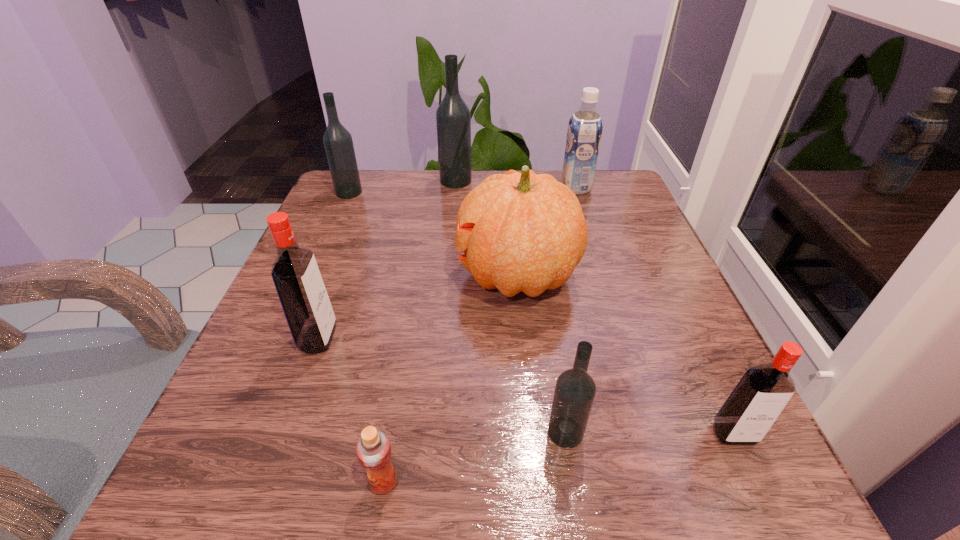
This screenshot has height=540, width=960. In order to click on vodka that is the nearest to the rightmost object in this screenshot , I will do `click(575, 390)`.

This screenshot has height=540, width=960. I want to click on vodka identified as the third closest to the biggest black vodka, so click(x=575, y=390).

Identify which black vodka is the third closest to the bigger red vodka. Please provide its 2D coordinates. Your answer should be formatted as a tuple, i.e. [(x, y)], where the tuple contains the x and y coordinates of a point satisfying the conditions above.

[(453, 119)]

Where is `black vodka that is the third closest to the orange pumpkin`? black vodka that is the third closest to the orange pumpkin is located at coordinates [338, 143].

Where is `vacant space that satisfies the following two spatial constraints: 1. on the front and back of the left red vodka; 2. on the back side of the rightmost black vodka`? This screenshot has height=540, width=960. vacant space that satisfies the following two spatial constraints: 1. on the front and back of the left red vodka; 2. on the back side of the rightmost black vodka is located at coordinates (284, 432).

I want to click on vacant point that satisfies the following two spatial constraints: 1. on the label of the seventh object from left to right; 2. on the front side of the smallest black vodka, so click(655, 432).

The image size is (960, 540). Find the location of `free space that satisfies the following two spatial constraints: 1. on the carved face of the smallest black vodka; 2. on the right side of the fourth farthest object`. free space that satisfies the following two spatial constraints: 1. on the carved face of the smallest black vodka; 2. on the right side of the fourth farthest object is located at coordinates (533, 432).